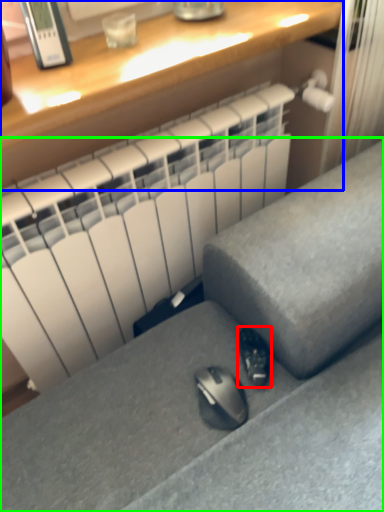
Question: Which is nearer to the shoe (highlighted by a red box)? desk (highlighted by a blue box) or furniture (highlighted by a green box).

Choices:
 (A) desk
 (B) furniture

Answer: (B)